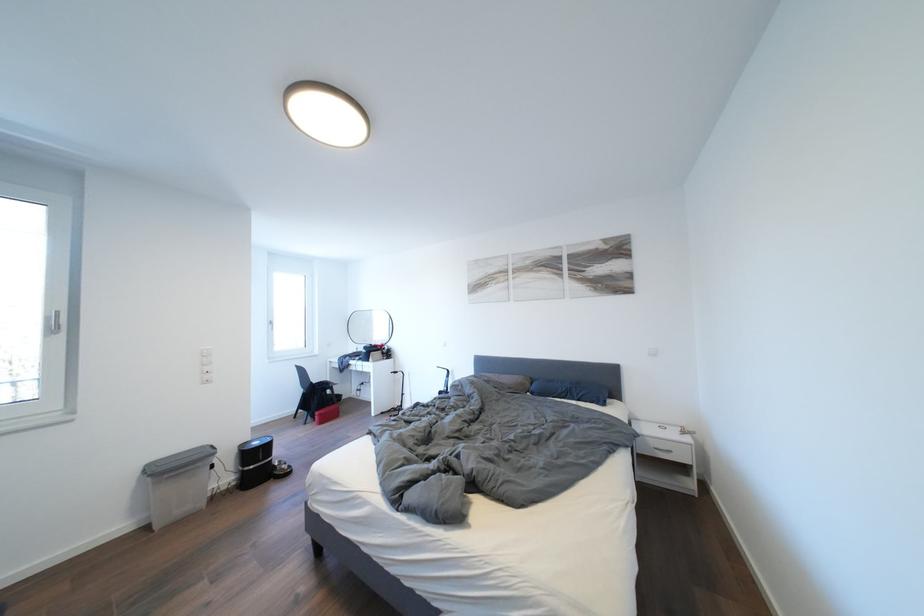
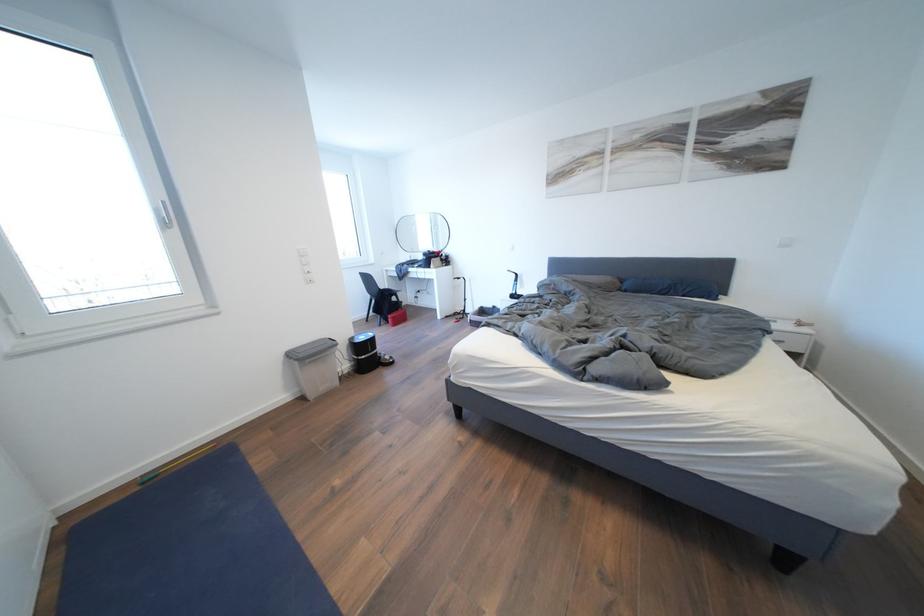
Question: The images are taken continuously from a first-person perspective. In which direction are you moving?

Choices:
 (A) Left
 (B) Right
 (C) Forward
 (D) Backward

Answer: (A)